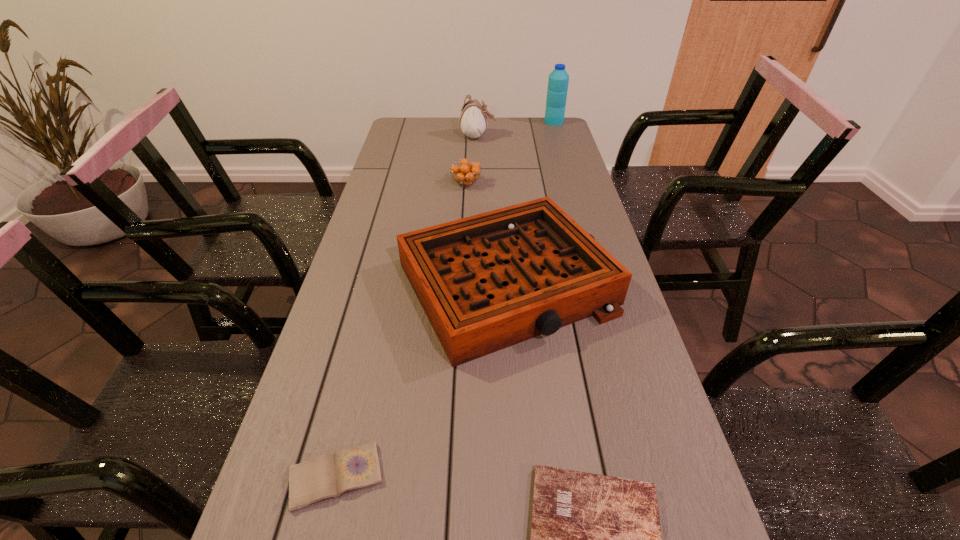
The height and width of the screenshot is (540, 960). Identify the location of free space located 0.180m on the front-facing side of the fifth nearest object. (540, 137).

The height and width of the screenshot is (540, 960). Find the location of `vacant space located 0.160m on the back of the fourth shortest object`. vacant space located 0.160m on the back of the fourth shortest object is located at coordinates (501, 197).

Image resolution: width=960 pixels, height=540 pixels. Find the location of `vacant space located 0.140m on the right of the fourth tallest object`. vacant space located 0.140m on the right of the fourth tallest object is located at coordinates (522, 184).

The height and width of the screenshot is (540, 960). Find the location of `vacant space located 0.210m on the right of the second shortest object`. vacant space located 0.210m on the right of the second shortest object is located at coordinates (502, 476).

Where is `water bottle situated at the far edge`? water bottle situated at the far edge is located at coordinates click(558, 80).

Identify the location of pouch present at the far edge. (473, 122).

Identify the location of gameboard that is positioned at the left edge. Image resolution: width=960 pixels, height=540 pixels. (486, 282).

Where is `diary that is at the left edge`? Image resolution: width=960 pixels, height=540 pixels. diary that is at the left edge is located at coordinates (327, 476).

I want to click on water bottle present at the right edge, so click(558, 80).

The height and width of the screenshot is (540, 960). I want to click on gameboard positioned at the right edge, so click(486, 282).